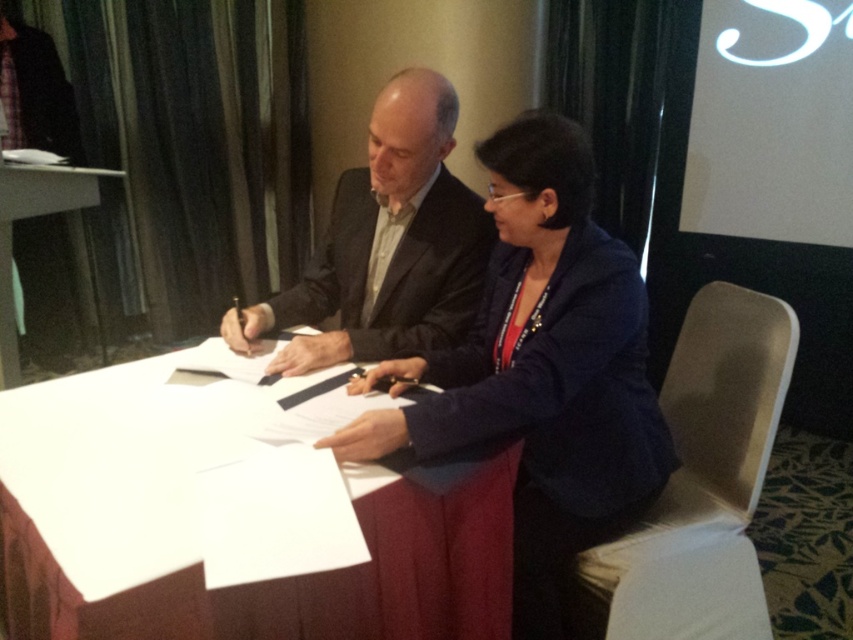
You are a photographer positioned behind the two people at the table. You want to capture a clear photo of the white paper at center without the dark blue fabric jacket at center blocking the view. Is this possible?

The white paper at center is closer to the viewer than the dark blue fabric jacket at center, so yes, the photographer can capture a clear photo of the white paper at center without the dark blue fabric jacket at center blocking the view because the paper is in front of the jacket.

You are a notary public observing the signing of a document. You need to ensure that all parties can clearly see the document. Given the white paper at center and the matte black suit at center, which object is shorter and therefore less likely to obstruct the view of the document?

The white paper at center is shorter than the matte black suit at center, so it is less likely to obstruct the view of the document.

You are a photographer standing behind the table and want to capture a photo of the white paper at center and the dark blue fabric jacket at center without any obstruction. Given that your camera has a minimum focus distance of 30 centimeters, can you take the photo from your current position?

The white paper at center and dark blue fabric jacket at center are 27.35 centimeters apart. Since the minimum focus distance is 30 centimeters, the distance between them is too short, so you cannot take the photo without obstruction.